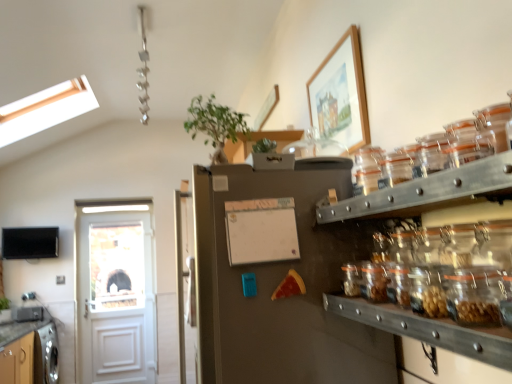
Question: Is point (338, 183) closer or farther from the camera than point (32, 233)?

Choices:
 (A) closer
 (B) farther

Answer: (A)

Question: In the image, is satin silver fridge at center positioned in front of or behind flat screen tv at left?

Choices:
 (A) front
 (B) behind

Answer: (A)

Question: Based on their relative distances, which object is nearer to the satin silver fridge at center?

Choices:
 (A) translucent glass jar at right
 (B) wooden picture frame at upper center
 (C) white matte bulletin board at center
 (D) green leafy plant at upper center
 (E) white matte cabinet at upper center, which ranks as the 2th cabinetry in back-to-front order

Answer: (C)

Question: Which of these objects is positioned farthest from the matte wood cabinet at lower left, which appears as the 1th cabinetry when viewed from the back?

Choices:
 (A) green leafy plant at upper center
 (B) satin silver fridge at center
 (C) clear glass jars at center right
 (D) wooden picture frame at upper center
 (E) white wooden door at left

Answer: (C)